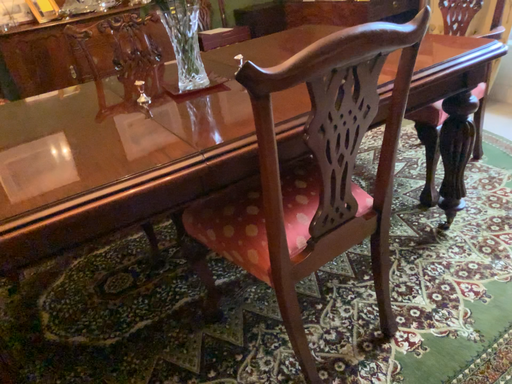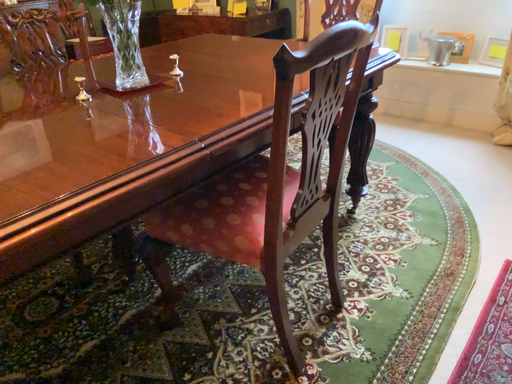
Question: How did the camera likely rotate when shooting the video?

Choices:
 (A) rotated left
 (B) rotated right

Answer: (B)